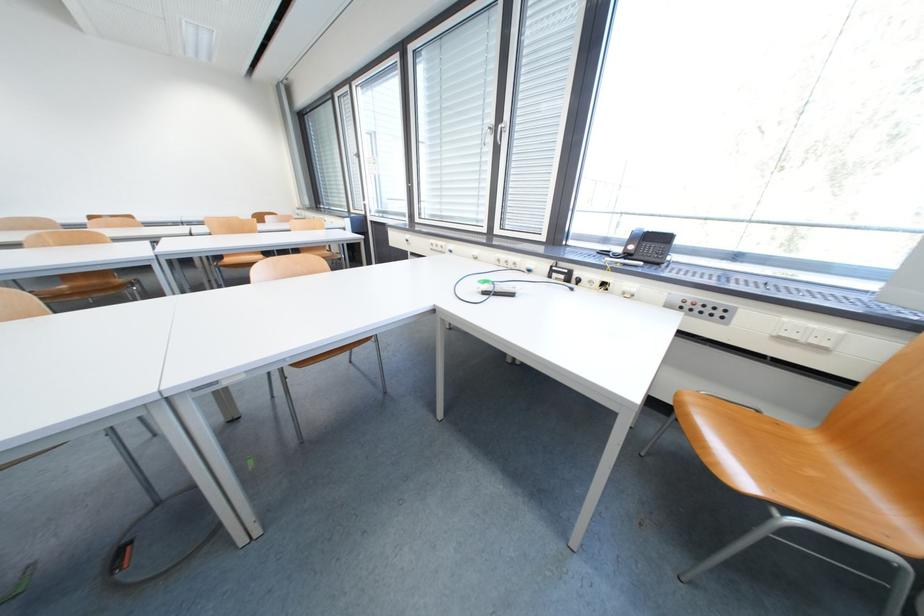
This screenshot has height=616, width=924. What do you see at coordinates (653, 246) in the screenshot?
I see `a black telephone handset` at bounding box center [653, 246].